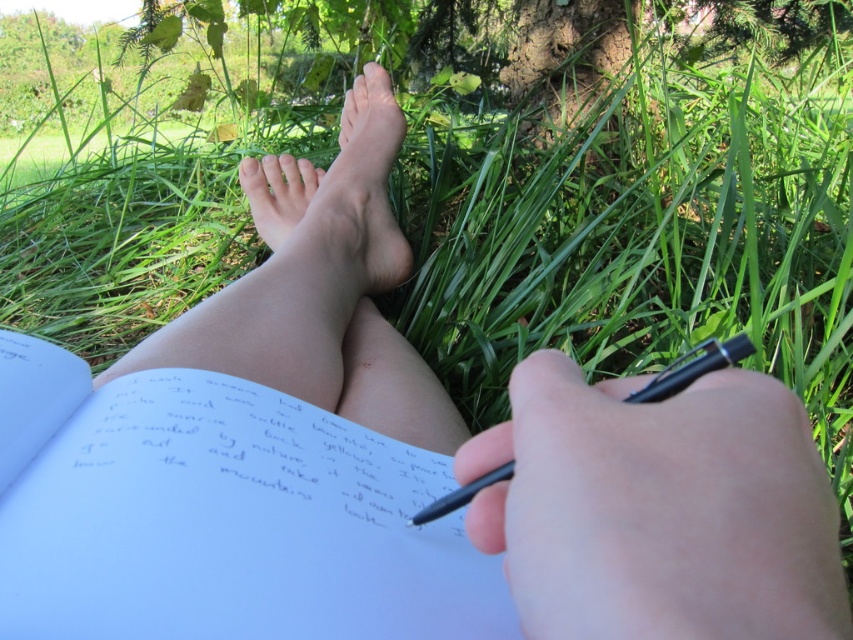
You are standing at the point with coordinates point (482, 483) and want to walk to the point with coordinates point (308, 216). Which direction should you face to walk towards your destination?

To walk from point (482, 483) to point (308, 216), you should face north and west since the destination point is behind the starting point.

You are trying to decide whether to place a small decorative item on the white paper journal at center or the black plastic pen at lower center. Based on their sizes, which object would allow the item to fit better?

The white paper journal at center has a larger width than the black plastic pen at lower center, so the item would fit better on the white paper journal at center.